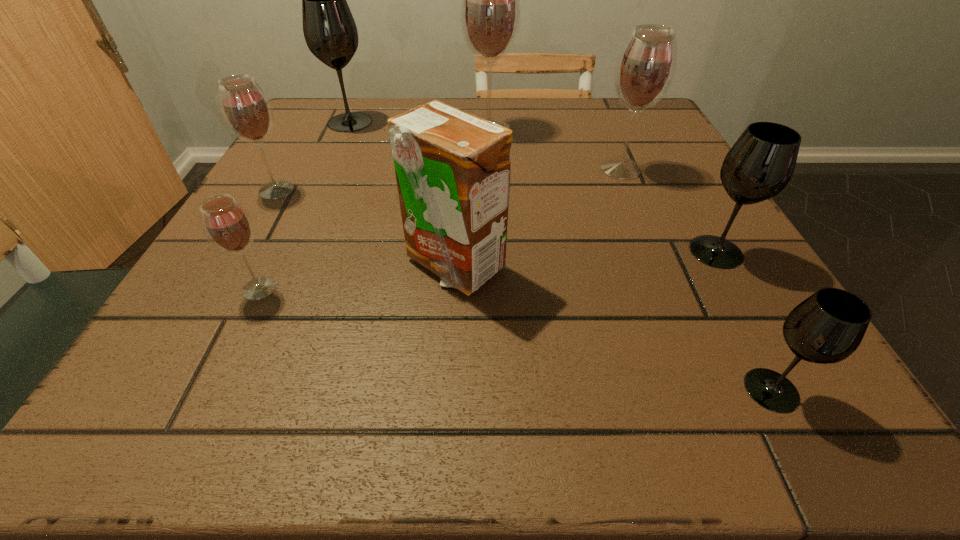
You are a GUI agent. You are given a task and a screenshot of the screen. Output one action in this format:
    pyautogui.click(x=<x>, y=<y>)
    Task: Click on the free spot between the smallest red wineglass and the biggest gray wineglass
    This screenshot has height=540, width=960.
    Given the screenshot: What is the action you would take?
    pyautogui.click(x=304, y=205)

You are a GUI agent. You are given a task and a screenshot of the screen. Output one action in this format:
    pyautogui.click(x=<x>, y=<y>)
    Task: Click on the free area in between the nearest red wineglass and the second smallest red wineglass
    The image size is (960, 540).
    Given the screenshot: What is the action you would take?
    268,239

Identify the location of blank region between the carton and the nearest gray wineglass. The height and width of the screenshot is (540, 960). (612, 327).

You are a GUI agent. You are given a task and a screenshot of the screen. Output one action in this format:
    pyautogui.click(x=<x>, y=<y>)
    Task: Click on the empty space between the tallest object and the second farthest gray wineglass
    This screenshot has height=540, width=960.
    Given the screenshot: What is the action you would take?
    pyautogui.click(x=603, y=191)

Identify the location of vacant area between the smallest red wineglass and the farthest gray wineglass. (304, 205).

In order to click on vacant space that's between the second smallest red wineglass and the nearest wineglass in this screenshot , I will do `click(524, 290)`.

At what (x,y) coordinates should I click in order to perform the action: click on vacant space that's between the smallest gray wineglass and the third biggest red wineglass. Please return your answer as a coordinate pair (x, y). The width and height of the screenshot is (960, 540). Looking at the image, I should click on (524, 290).

Identify which object is the fourth closest to the second smallest red wineglass. Please provide its 2D coordinates. Your answer should be formatted as a tuple, i.e. [(x, y)], where the tuple contains the x and y coordinates of a point satisfying the conditions above.

[(490, 12)]

Locate an element on the screen. the third closest object to the biggest red wineglass is located at coordinates (452, 168).

Find the location of `the sixth closest wineglass to the biggest gray wineglass`. the sixth closest wineglass to the biggest gray wineglass is located at coordinates (827, 327).